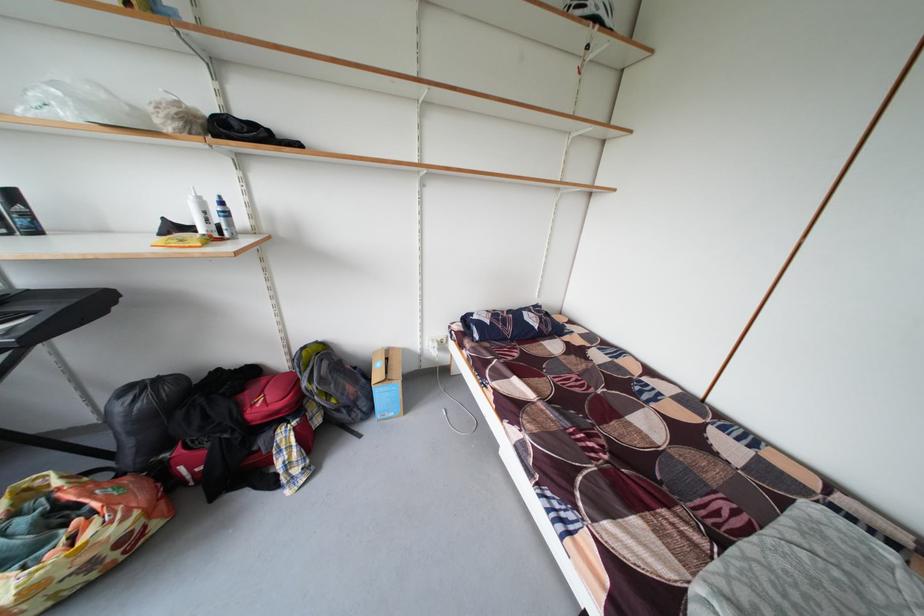
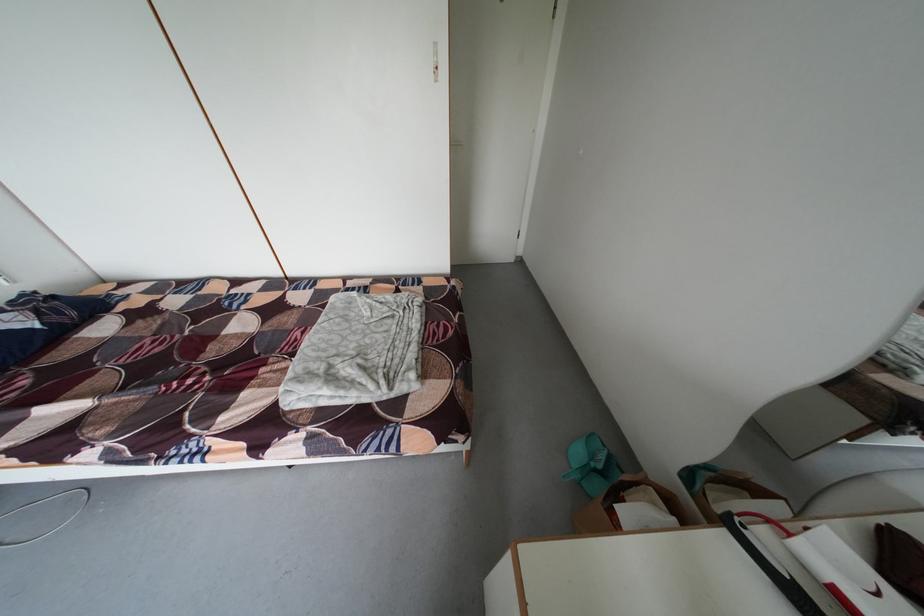
Where in the second image is the point corresponding to pixel 735 512 from the first image?

(309, 339)